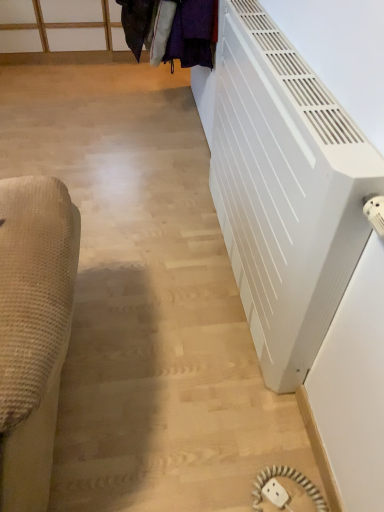
This screenshot has width=384, height=512. In order to click on vacant space behind white plastic outlet at lower right in this screenshot , I will do point(269,435).